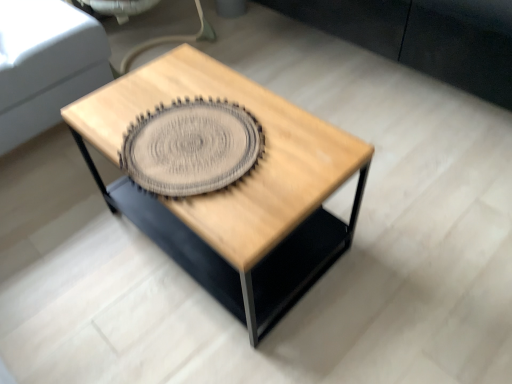
Locate an element on the screen. The image size is (512, 384). empty space that is to the right of natural wood coffee table at center is located at coordinates (407, 239).